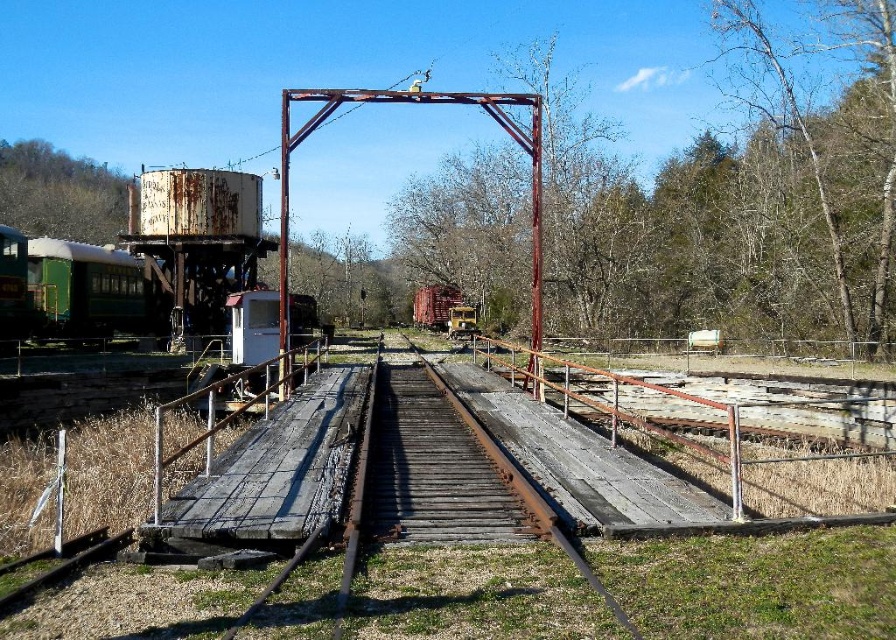
Question: Which point is closer to the camera taking this photo?

Choices:
 (A) (143, 307)
 (B) (433, 307)

Answer: (A)

Question: Where is green painted metal train car at left located in relation to rusty metal train car at center in the image?

Choices:
 (A) above
 (B) below

Answer: (B)

Question: Does green painted metal train car at left have a lesser width compared to rusty metal train car at center?

Choices:
 (A) yes
 (B) no

Answer: (A)

Question: Does green painted metal train car at left lie in front of rusty metal train car at center?

Choices:
 (A) no
 (B) yes

Answer: (B)

Question: Which point is closer to the camera?

Choices:
 (A) green painted metal train car at left
 (B) rusty metal train car at center

Answer: (A)